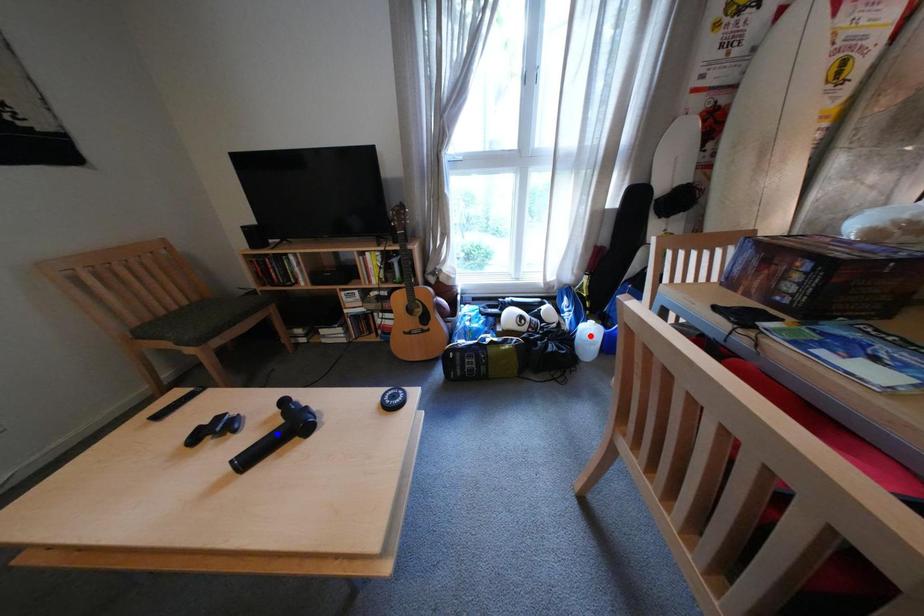
Question: In the image, two points are highlighted. Which point is nearer to the camera? Reply with the corresponding letter.

Choices:
 (A) blue point
 (B) red point

Answer: (A)